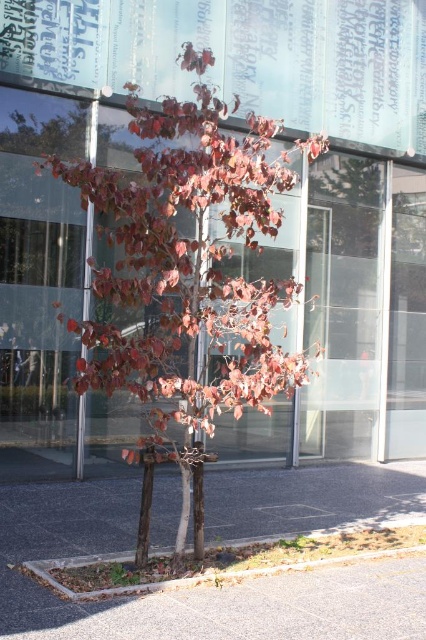
You are standing at the edge of the brown asphalt at lower center and want to step onto the gray concrete curb at lower center. Which surface is higher, requiring you to lift your foot more when stepping?

The gray concrete curb at lower center is taller than the brown asphalt at lower center, so you will need to lift your foot more to step onto it.